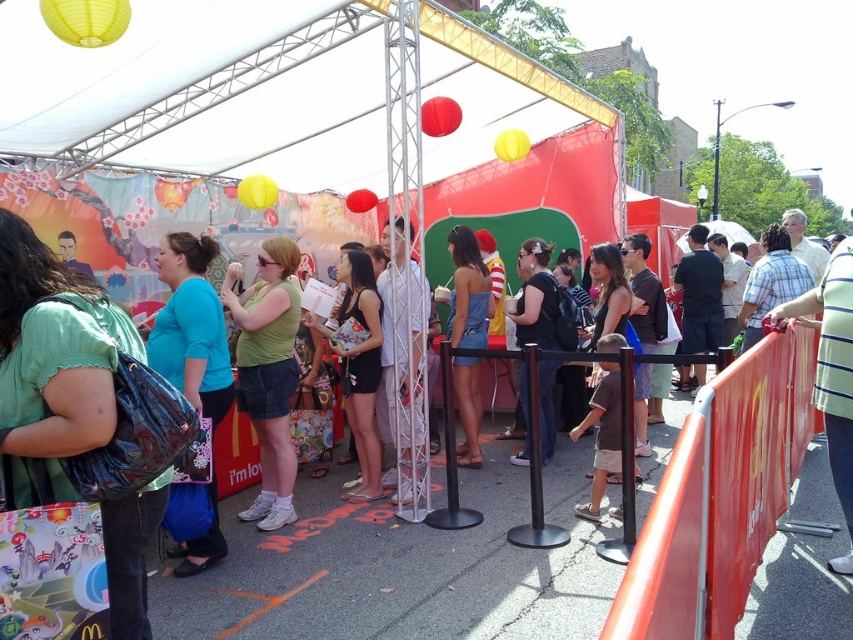
You are standing at the entrance of the event and want to take a photo. There are two points marked in the image. The first point is at coordinate point (408, 269) and the second is at point (302, 589). Which point is closer to you, the photographer?

Point (408, 269) is further to the camera than point (302, 589), so the point closer to you is point (302, 589).

You are a photographer at the event and need to capture a photo of the green denim shorts at center and white matte shirt at center. Which object should you focus on first if you want to ensure both are in focus without adjusting the camera settings?

The green denim shorts at center is wider than the white matte shirt at center, so you should focus on the wider object first to ensure both are in focus.